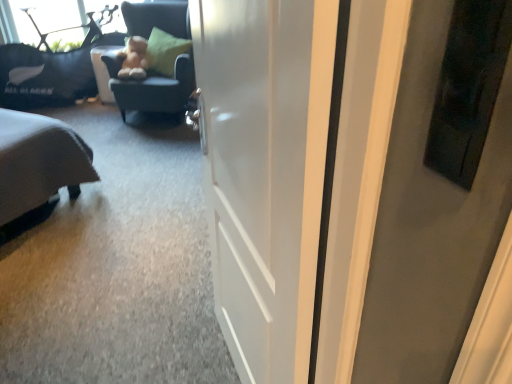
Question: Is fuzzy brown teddy bear at upper center spatially inside dark blue fabric chair at upper left, or outside of it?

Choices:
 (A) outside
 (B) inside

Answer: (B)

Question: Relative to dark blue fabric chair at upper left, is fuzzy brown teddy bear at upper center in front or behind?

Choices:
 (A) behind
 (B) front

Answer: (A)

Question: Which object is the closest to the dark blue fabric chair at upper left?

Choices:
 (A) fuzzy brown teddy bear at upper center
 (B) white glossy door at center
 (C) black fabric couch at upper left

Answer: (A)

Question: Considering the real-world distances, which object is closest to the black fabric couch at upper left?

Choices:
 (A) dark blue fabric chair at upper left
 (B) white glossy door at center
 (C) fuzzy brown teddy bear at upper center

Answer: (C)